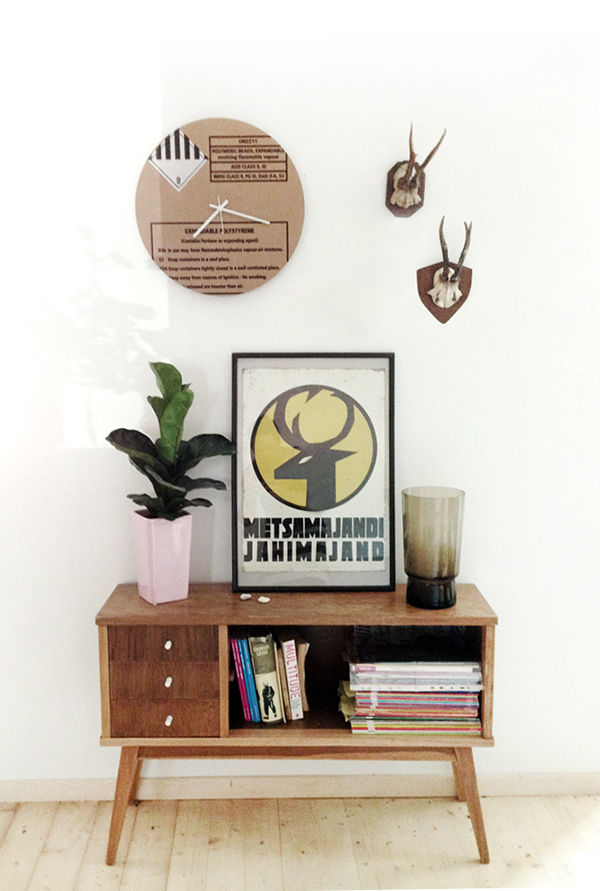
Find the location of `wall decorations`. wall decorations is located at coordinates (229, 178), (407, 181), (444, 295).